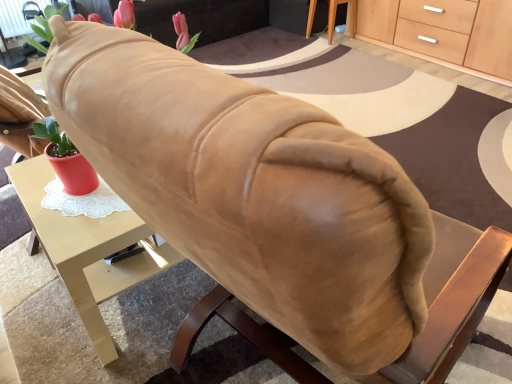
At what (x,y) coordinates should I click in order to perform the action: click on free space in front of matte gold desk at center. Please return your answer as a coordinate pair (x, y). Looking at the image, I should click on (112, 355).